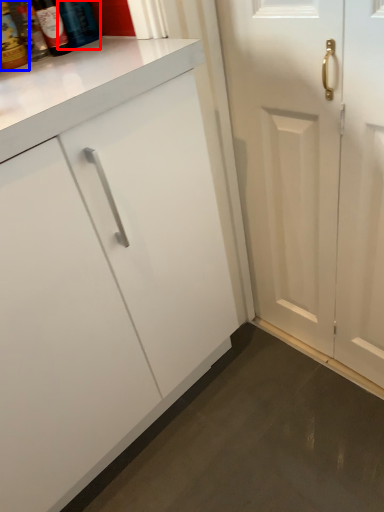
Question: Which point is closer to the camera, bottle (highlighted by a red box) or bottle (highlighted by a blue box)?

Choices:
 (A) bottle
 (B) bottle

Answer: (B)